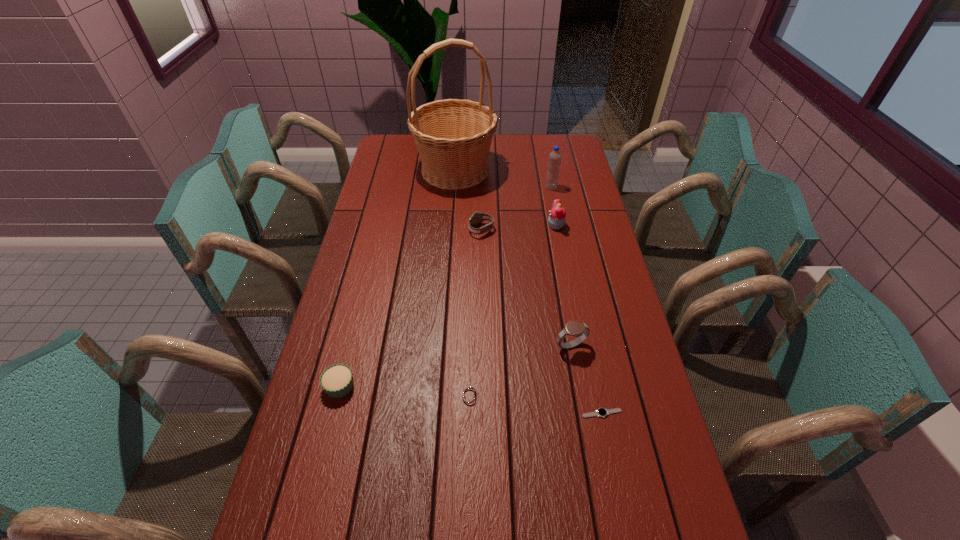
Where is `the tallest object`? This screenshot has height=540, width=960. the tallest object is located at coordinates (453, 137).

Where is `water bottle`? water bottle is located at coordinates (554, 162).

Image resolution: width=960 pixels, height=540 pixels. I want to click on the right cupcake, so click(557, 217).

Locate an element on the screen. The width and height of the screenshot is (960, 540). the farther cupcake is located at coordinates (557, 217).

Where is `the fourth nearest object`? This screenshot has height=540, width=960. the fourth nearest object is located at coordinates (573, 328).

Find the location of a particular element. This screenshot has width=960, height=540. the second farthest watch is located at coordinates (573, 328).

You are a GUI agent. You are given a task and a screenshot of the screen. Output one action in this format:
    pyautogui.click(x=<x>, y=<y>)
    Task: Click on the fifth tallest object
    This screenshot has width=960, height=540.
    Given the screenshot: What is the action you would take?
    pyautogui.click(x=476, y=218)

I want to click on the second tallest watch, so click(476, 218).

Identify the location of the nearer cupcake. The image size is (960, 540). (337, 380).

Locate an element on the screen. the leftmost object is located at coordinates (337, 380).